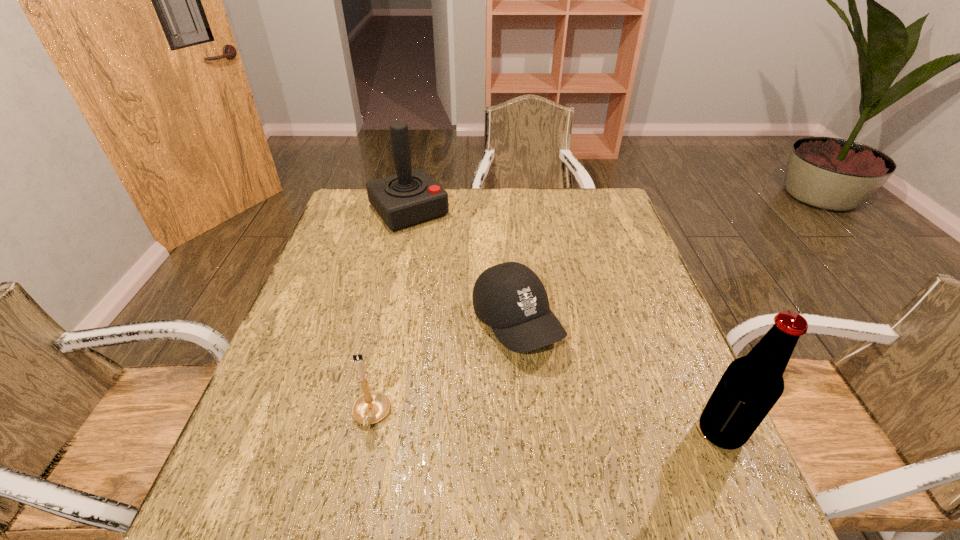
The height and width of the screenshot is (540, 960). What are the coordinates of `vacant region at the near edge of the desktop` in the screenshot? It's located at pos(537,461).

Where is `blank area at the left edge`? This screenshot has height=540, width=960. blank area at the left edge is located at coordinates (332, 389).

I want to click on vacant area at the right edge, so click(x=584, y=240).

Where is `vacant space at the far left corner of the desktop`? The width and height of the screenshot is (960, 540). vacant space at the far left corner of the desktop is located at coordinates (366, 196).

Where is `free space at the near right corner of the desktop`? The image size is (960, 540). free space at the near right corner of the desktop is located at coordinates (657, 450).

Find the location of a particular element. This screenshot has height=540, width=960. free space between the rightmost object and the third nearest object is located at coordinates (618, 378).

At what (x,y) coordinates should I click in order to perform the action: click on vacant space that's between the second object from right to left and the candle holder. Please return your answer as a coordinate pair (x, y). The height and width of the screenshot is (540, 960). Looking at the image, I should click on (444, 370).

This screenshot has height=540, width=960. In order to click on empty location between the second object from right to left and the candle holder in this screenshot , I will do `click(444, 370)`.

Find the location of `free spot between the candle holder and the rightmost object`. free spot between the candle holder and the rightmost object is located at coordinates (546, 424).

This screenshot has width=960, height=540. Find the location of `free space between the second shortest object and the rightmost object`. free space between the second shortest object and the rightmost object is located at coordinates (546, 424).